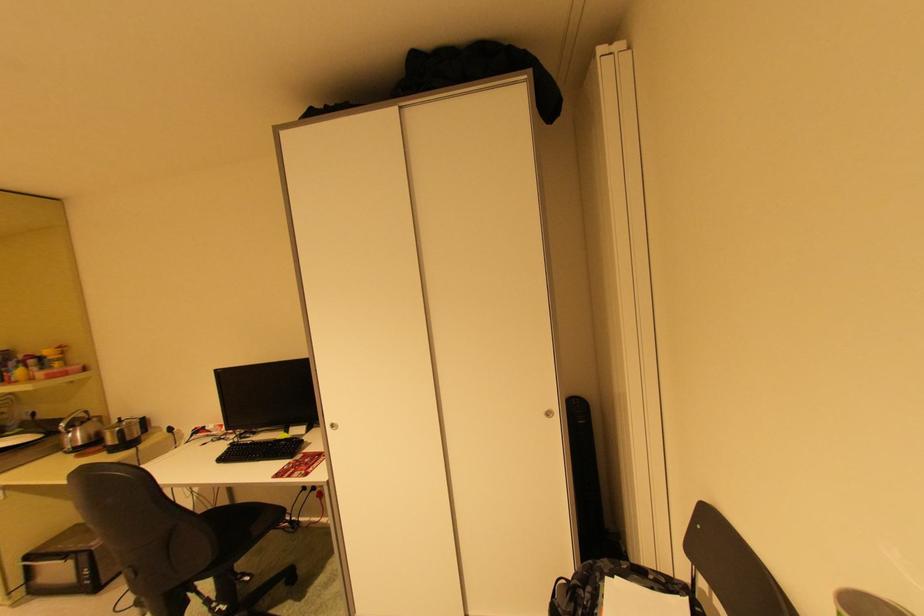
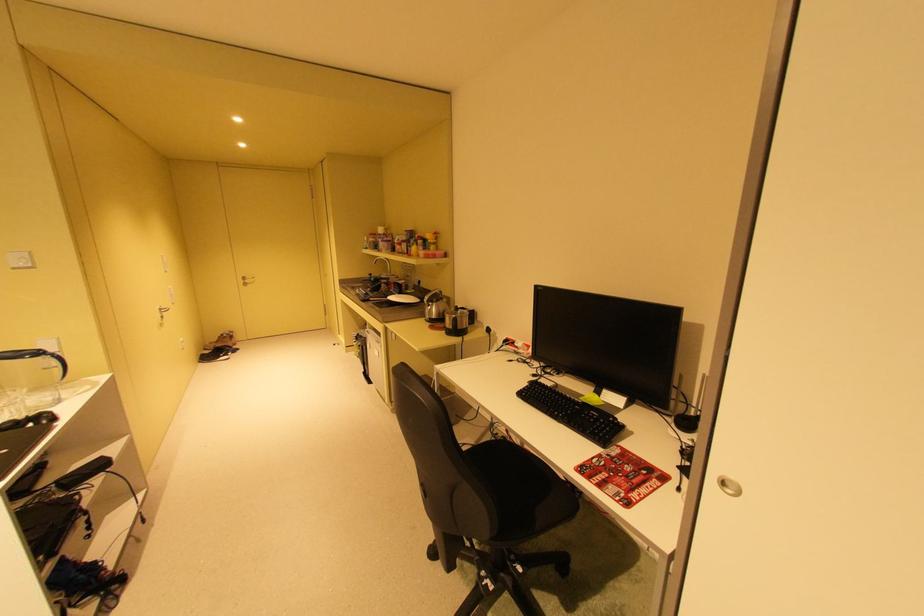
Find the pixel in the second image that matches [37,357] in the first image.

(428, 237)